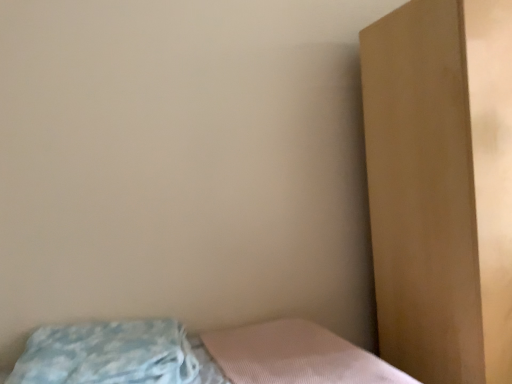
Question: In terms of size, does brown matte dresser at right appear bigger or smaller than blue textured pillow at lower left?

Choices:
 (A) big
 (B) small

Answer: (A)

Question: Is brown matte dresser at right inside or outside of blue textured pillow at lower left?

Choices:
 (A) outside
 (B) inside

Answer: (A)

Question: Is brown matte dresser at right to the left or to the right of blue textured pillow at lower left in the image?

Choices:
 (A) right
 (B) left

Answer: (A)

Question: From the image's perspective, relative to brown matte dresser at right, is blue textured pillow at lower left above or below?

Choices:
 (A) above
 (B) below

Answer: (B)

Question: Is blue textured pillow at lower left wider or thinner than brown matte dresser at right?

Choices:
 (A) wide
 (B) thin

Answer: (B)

Question: From a real-world perspective, is blue textured pillow at lower left above or below brown matte dresser at right?

Choices:
 (A) below
 (B) above

Answer: (A)

Question: Is point (18, 374) positioned closer to the camera than point (443, 316)?

Choices:
 (A) closer
 (B) farther

Answer: (A)